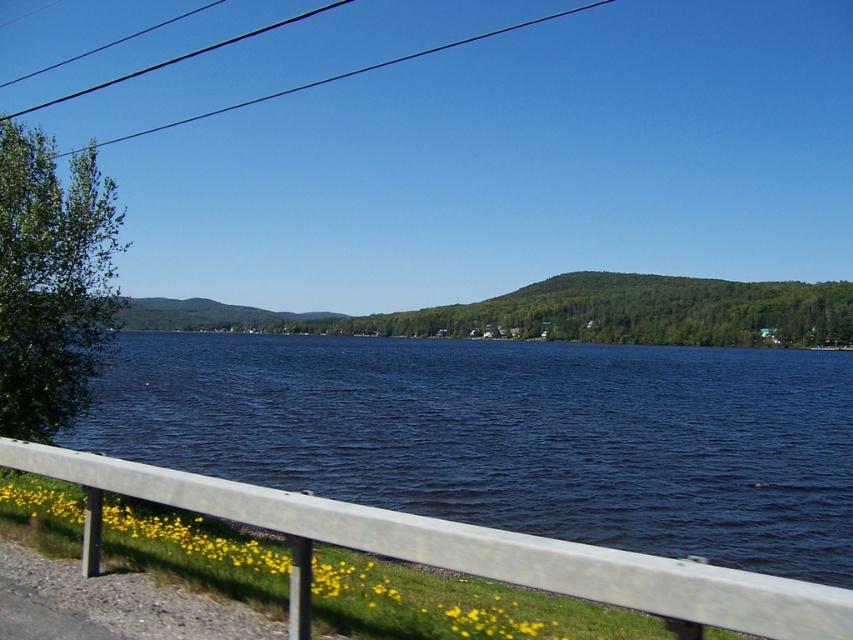
Based on the photo, you are a painter setting up your easel to paint the lakeside scene. You need to decide which object, the silver metallic rail at lower center or the black wire at upper left, will fit better on a narrow canvas section that can only accommodate items up to the width of the narrower object. Which object should you choose?

The silver metallic rail at lower center has a width less than the black wire at upper left, so it will fit better in the narrow canvas section.

You are a photographer setting up equipment. You have a tripod that requires a space larger than the silver metallic rail at lower center. Can the black wire at upper left accommodate your tripod?

The silver metallic rail at lower center has a smaller size compared to the black wire at upper left, so the black wire at upper left can accommodate the tripod since it is larger in size.